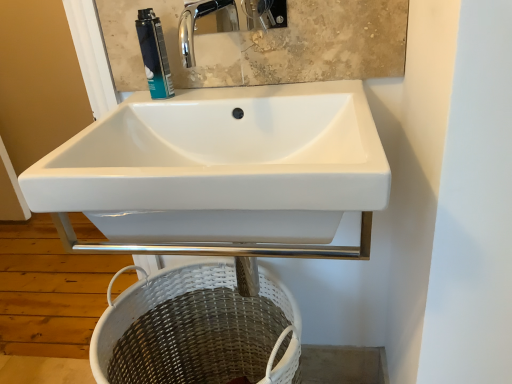
The height and width of the screenshot is (384, 512). Find the location of `spots to the right of blue metallic can at upper center`. spots to the right of blue metallic can at upper center is located at coordinates (237, 98).